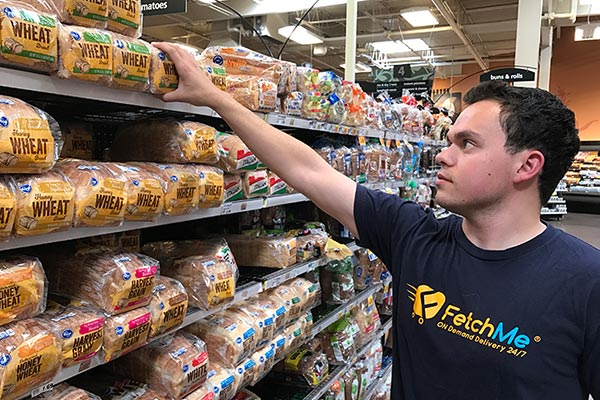
Identify the location of support pillars. This screenshot has height=400, width=600. (526, 47), (543, 66), (347, 62).